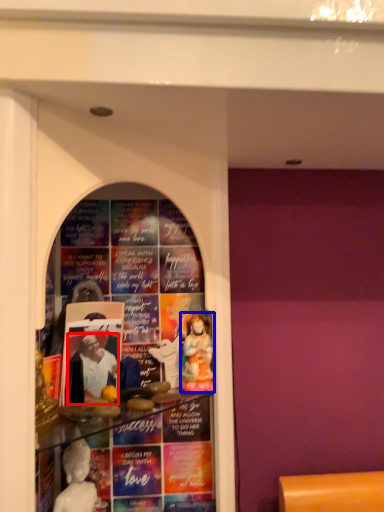
Question: Among these objects, which one is nearest to the camera, person (highlighted by a red box) or person (highlighted by a blue box)?

Choices:
 (A) person
 (B) person

Answer: (A)